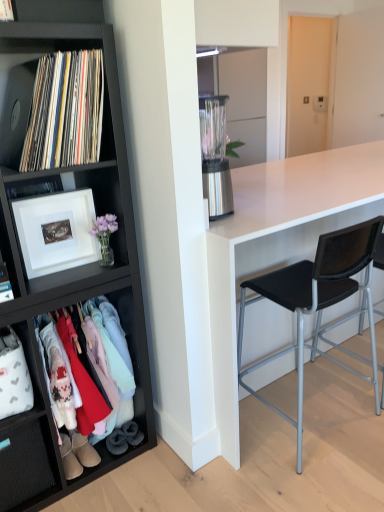
This screenshot has width=384, height=512. I want to click on vacant space in between black plastic chair at right, which ranks as the 2th chair in left-to-right order, and black mesh chair at right, the second chair viewed from the right, so click(x=337, y=387).